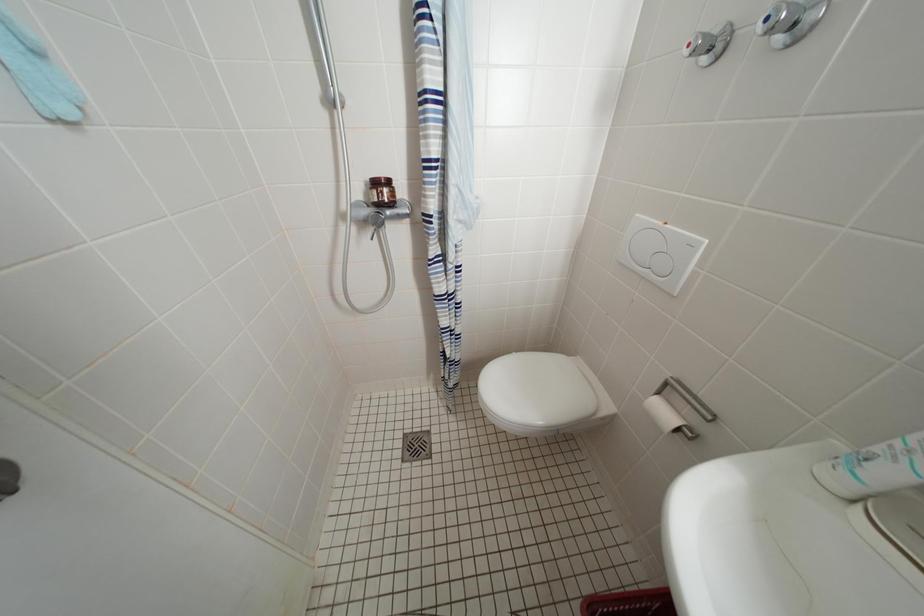
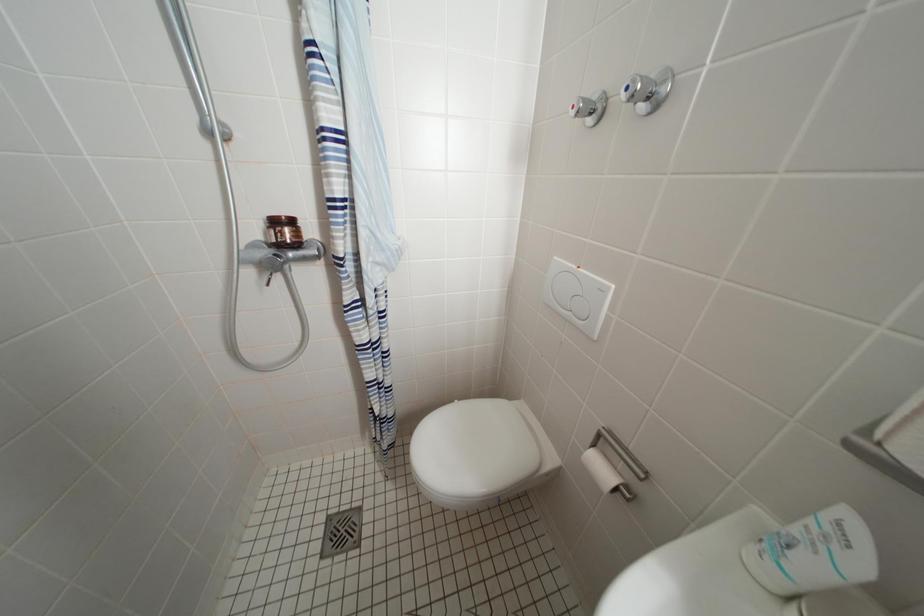
What movement of the cameraman would produce the second image?

The movement direction of the cameraman is right, forward.